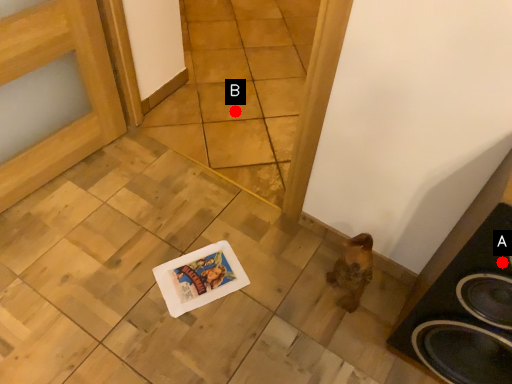
Question: Two points are circled on the image, labeled by A and B beside each circle. Among these points, which one is farthest from the camera?

Choices:
 (A) A is further
 (B) B is further

Answer: (B)